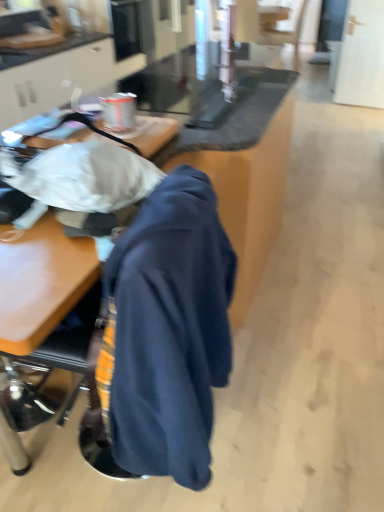
Question: Is navy blue hoodie at center thinner than black leather swivel chair at upper right?

Choices:
 (A) no
 (B) yes

Answer: (B)

Question: Is navy blue hoodie at center touching black leather swivel chair at upper right?

Choices:
 (A) yes
 (B) no

Answer: (B)

Question: Can you confirm if navy blue hoodie at center is bigger than black leather swivel chair at upper right?

Choices:
 (A) no
 (B) yes

Answer: (A)

Question: Is navy blue hoodie at center to the right of black leather swivel chair at upper right from the viewer's perspective?

Choices:
 (A) yes
 (B) no

Answer: (B)

Question: Is navy blue hoodie at center further to camera compared to black leather swivel chair at upper right?

Choices:
 (A) yes
 (B) no

Answer: (B)

Question: Is black leather swivel chair at upper right a part of navy blue hoodie at center?

Choices:
 (A) no
 (B) yes

Answer: (A)

Question: Is dark blue fabric at center closer to the viewer compared to wooden table at center?

Choices:
 (A) no
 (B) yes

Answer: (B)

Question: Is dark blue fabric at center bigger than wooden table at center?

Choices:
 (A) yes
 (B) no

Answer: (B)

Question: Does dark blue fabric at center have a smaller size compared to wooden table at center?

Choices:
 (A) no
 (B) yes

Answer: (B)

Question: Is dark blue fabric at center positioned with its back to wooden table at center?

Choices:
 (A) yes
 (B) no

Answer: (B)

Question: Is wooden table at center located within dark blue fabric at center?

Choices:
 (A) no
 (B) yes

Answer: (A)

Question: Is dark blue fabric at center placed right next to wooden table at center?

Choices:
 (A) no
 (B) yes

Answer: (A)

Question: Does black leather swivel chair at upper right have a larger size compared to wooden table at center?

Choices:
 (A) yes
 (B) no

Answer: (B)